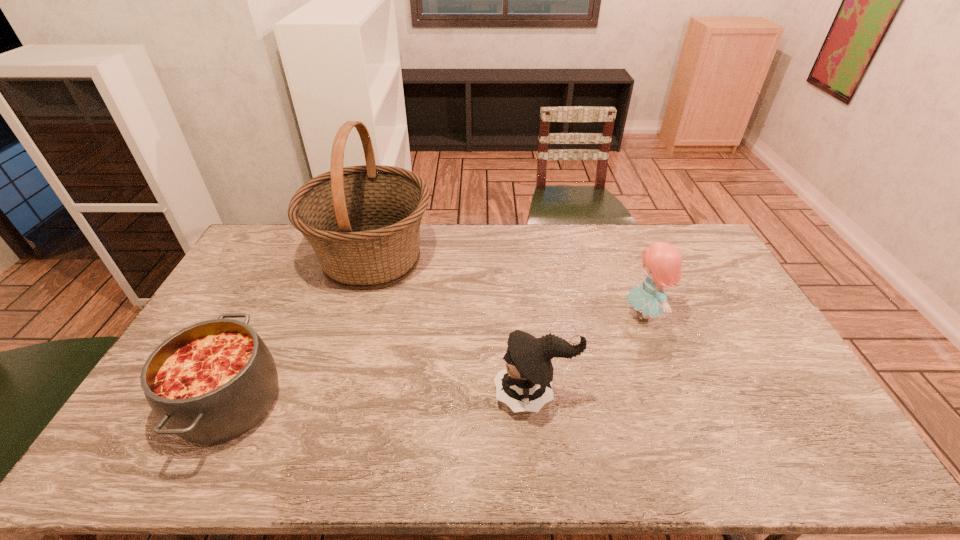
Locate an element on the screen. The width and height of the screenshot is (960, 540). the tallest object is located at coordinates (363, 222).

The height and width of the screenshot is (540, 960). Find the location of `the farther doll`. the farther doll is located at coordinates (662, 261).

The width and height of the screenshot is (960, 540). I want to click on the right doll, so click(x=662, y=261).

Locate an element on the screen. the third tallest object is located at coordinates (526, 384).

The image size is (960, 540). Identify the location of the shorter doll. (526, 384).

At what (x,y) coordinates should I click in order to perform the action: click on the shortest object. Please return your answer as a coordinate pair (x, y). This screenshot has height=540, width=960. Looking at the image, I should click on (213, 381).

Image resolution: width=960 pixels, height=540 pixels. I want to click on vacant area located 0.100m on the left of the tallest object, so click(284, 259).

This screenshot has height=540, width=960. In order to click on free spot located on the front-facing side of the farther doll in this screenshot , I will do `click(597, 315)`.

At what (x,y) coordinates should I click in order to perform the action: click on vacant space situated 0.200m on the front-facing side of the farther doll. Please return your answer as a coordinate pair (x, y). The width and height of the screenshot is (960, 540). Looking at the image, I should click on pos(561,315).

This screenshot has width=960, height=540. In order to click on free region located on the front-facing side of the farther doll in this screenshot , I will do `click(564, 315)`.